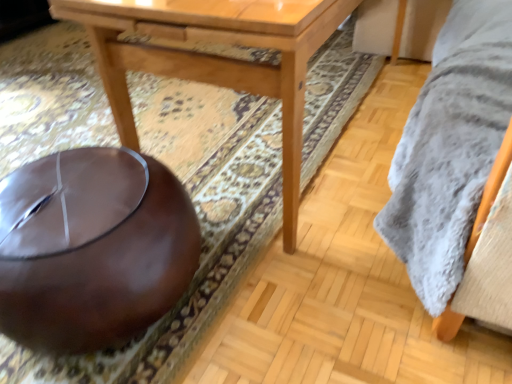
I want to click on unoccupied space behind brown leather bean bag at lower left, so click(176, 153).